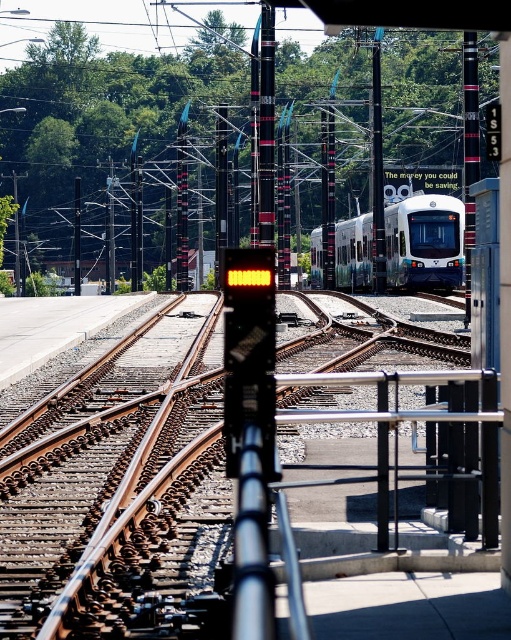
Question: Among these points, which one is farthest from the camera?

Choices:
 (A) (383, 173)
 (B) (80, 244)
 (C) (267, 32)

Answer: (B)

Question: Does white glossy passenger train at center have a greater width compared to black glossy pole at center?

Choices:
 (A) yes
 (B) no

Answer: (A)

Question: Which of the following is the closest to the observer?

Choices:
 (A) black metal pole at left
 (B) metallic pole at center
 (C) black textured pole at center
 (D) white glossy passenger train at center

Answer: (C)

Question: Considering the real-world distances, which object is closest to the black textured pole at center?

Choices:
 (A) white glossy passenger train at center
 (B) black metal pole at left

Answer: (A)

Question: Is white glossy passenger train at center positioned behind black metal pole at left?

Choices:
 (A) no
 (B) yes

Answer: (A)

Question: Is black glossy pole at center thinner than black textured pole at center?

Choices:
 (A) yes
 (B) no

Answer: (A)